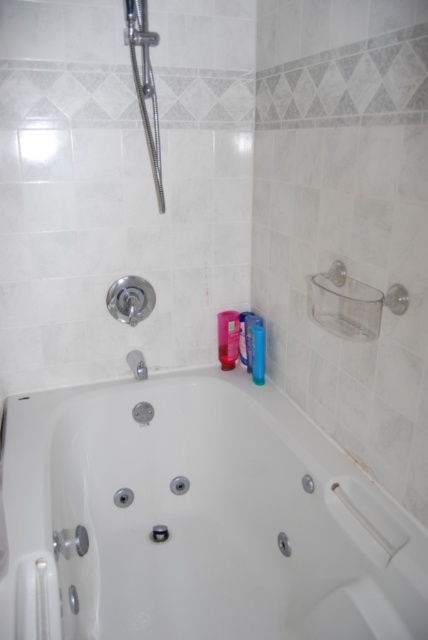
Question: Which of the following is the closest to the observer?

Choices:
 (A) (244, 362)
 (B) (91, 433)
 (C) (253, 317)
 (D) (256, 364)

Answer: (B)

Question: Which point appears closest to the camera in this image?

Choices:
 (A) (243, 356)
 (B) (244, 320)

Answer: (B)

Question: Which of these objects is positioned closest to the pink plastic cup at upper right?

Choices:
 (A) pink matte bottle at upper right
 (B) blue plastic bottle at upper right
 (C) polished chrome showerhead at upper left
 (D) pink plastic bottle at upper right

Answer: (A)

Question: Does polished chrome showerhead at upper left have a smaller size compared to pink plastic cup at upper right?

Choices:
 (A) yes
 (B) no

Answer: (B)

Question: Is pink plastic bottle at upper right in front of pink matte bottle at upper right?

Choices:
 (A) yes
 (B) no

Answer: (B)

Question: Can you confirm if polished chrome showerhead at upper left is positioned to the right of pink plastic bottle at upper right?

Choices:
 (A) no
 (B) yes

Answer: (A)